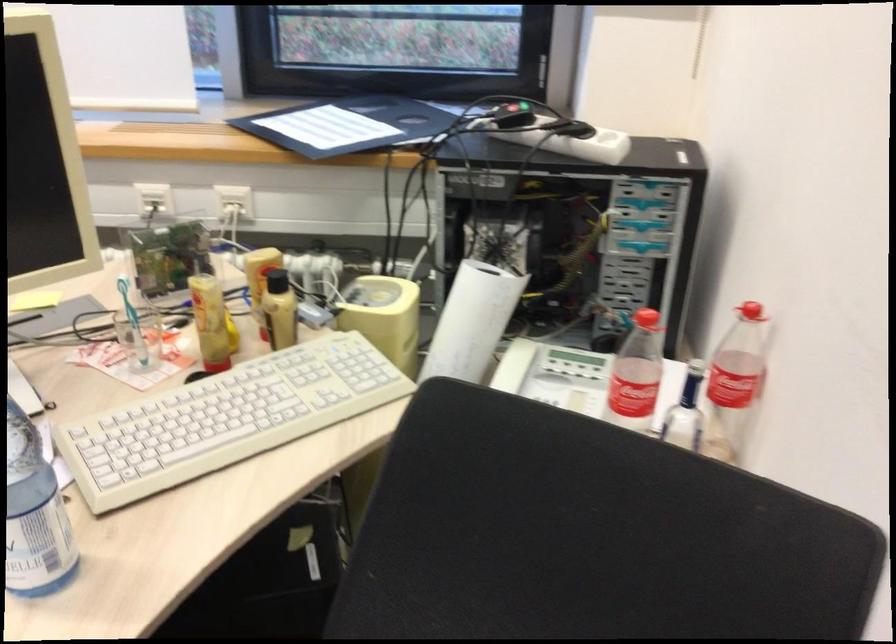
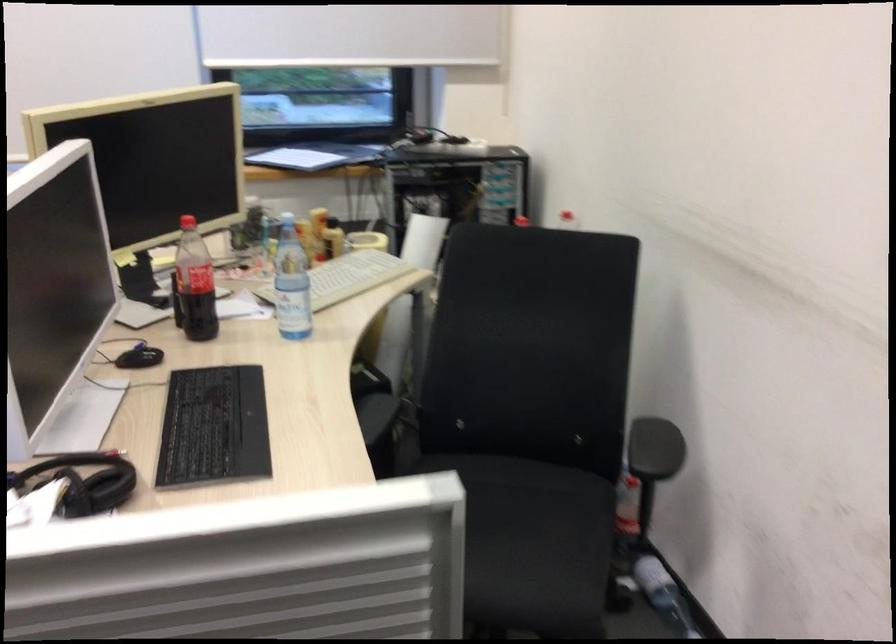
Find the pixel in the second image that matches [280,406] in the first image.

(347, 277)